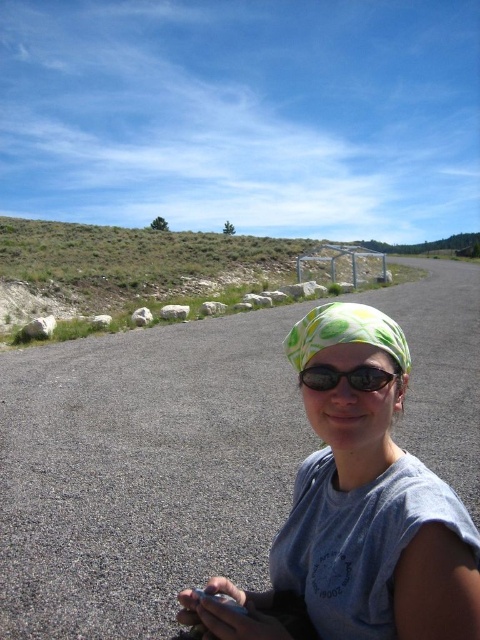
Can you confirm if light blue cotton shirt at center is taller than printed fabric headscarf at center?

Yes.

Does point (470, 522) come in front of point (330, 332)?

Yes, it is.

Describe the element at coordinates (371, 500) in the screenshot. The width and height of the screenshot is (480, 640). I see `light blue cotton shirt at center` at that location.

At what (x,y) coordinates should I click in order to perform the action: click on light blue cotton shirt at center. Please return your answer as a coordinate pair (x, y). This screenshot has width=480, height=640. Looking at the image, I should click on (371, 500).

Is light blue cotton shirt at center behind matte black sunglasses at center?

No, it is not.

Does light blue cotton shirt at center have a lesser width compared to matte black sunglasses at center?

Incorrect, light blue cotton shirt at center's width is not less than matte black sunglasses at center's.

Describe the element at coordinates (371, 500) in the screenshot. I see `light blue cotton shirt at center` at that location.

Where is `light blue cotton shirt at center`? The width and height of the screenshot is (480, 640). light blue cotton shirt at center is located at coordinates (371, 500).

Can you confirm if printed fabric headscarf at center is positioned below matte black sunglasses at center?

Actually, printed fabric headscarf at center is above matte black sunglasses at center.

Does point (287, 355) lie behind point (397, 385)?

Yes, it is behind point (397, 385).

The height and width of the screenshot is (640, 480). Find the location of `printed fabric headscarf at center`. printed fabric headscarf at center is located at coordinates tap(345, 332).